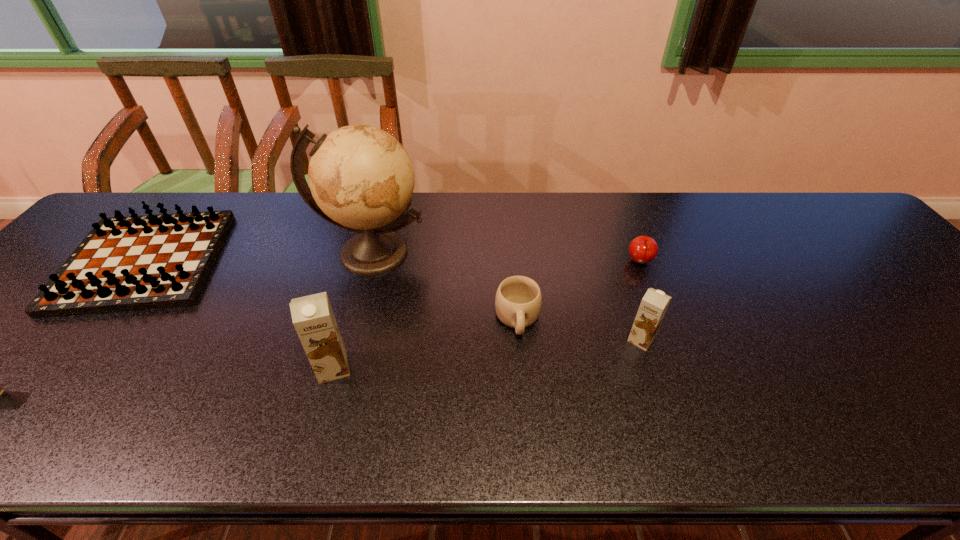
At what (x,y) coordinates should I click in order to perform the action: click on the nearest object. Please return your answer as a coordinate pair (x, y). The width and height of the screenshot is (960, 540). Looking at the image, I should click on click(313, 318).

Identify the location of the fifth shortest object. The width and height of the screenshot is (960, 540). (313, 318).

Find the location of `the farther chocolate milk`. the farther chocolate milk is located at coordinates tap(654, 304).

Where is `the right chocolate milk`? Image resolution: width=960 pixels, height=540 pixels. the right chocolate milk is located at coordinates (654, 304).

You are a GUI agent. You are given a task and a screenshot of the screen. Output one action in this format:
    pyautogui.click(x=<x>, y=<y>)
    Task: Click on the leftmost object
    The height and width of the screenshot is (540, 960).
    Given the screenshot: What is the action you would take?
    click(x=130, y=263)

Where is `globe`? The image size is (960, 540). globe is located at coordinates (361, 179).

Find the location of a particular element. cherry is located at coordinates (643, 249).

Where is `the third object from right to left`? the third object from right to left is located at coordinates (518, 302).

Image resolution: width=960 pixels, height=540 pixels. Find the location of `vacant space located on the left of the second tallest object`. vacant space located on the left of the second tallest object is located at coordinates (193, 367).

At what (x,y) coordinates should I click in order to perform the action: click on free location located on the back of the farther chocolate milk. Please return your answer as a coordinate pair (x, y). Looking at the image, I should click on (603, 224).